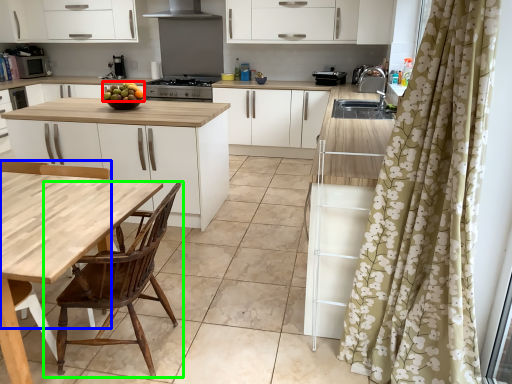
Question: Estimate the real-world distances between objects in this image. Which object is closer to fruit (highlighted by a red box), chair (highlighted by a blue box) or chair (highlighted by a green box)?

Choices:
 (A) chair
 (B) chair

Answer: (A)